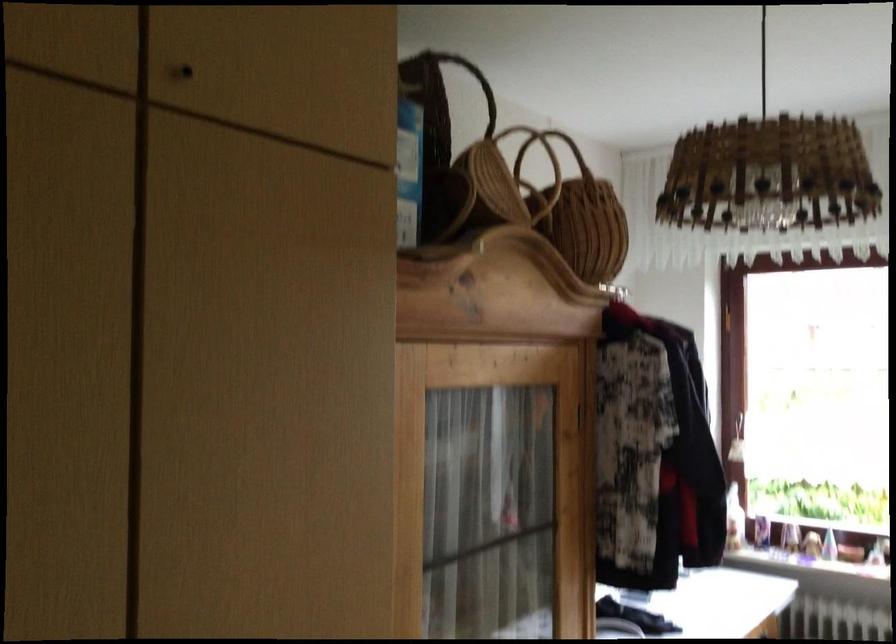
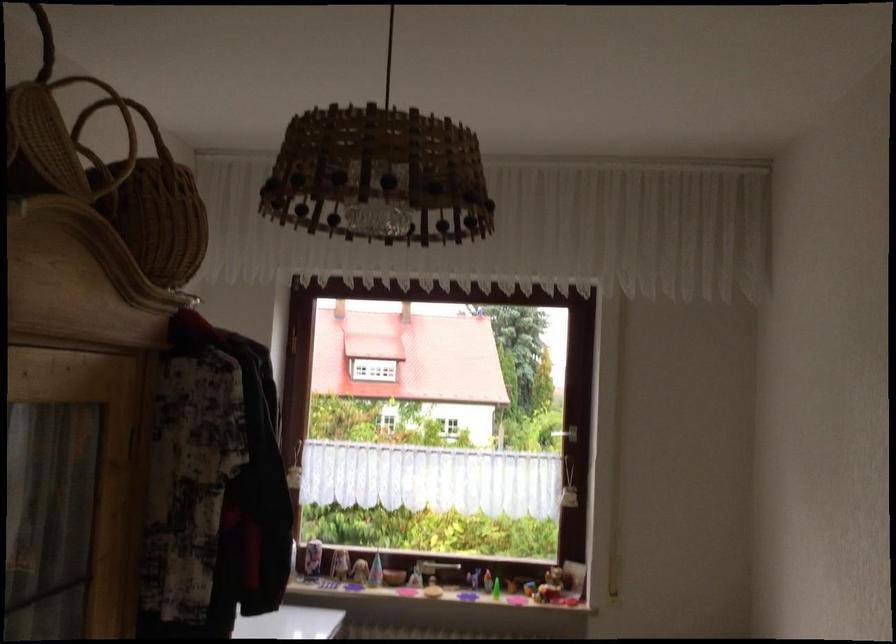
Find the pixel in the second image that matches (554,154) in the first image.

(128, 122)